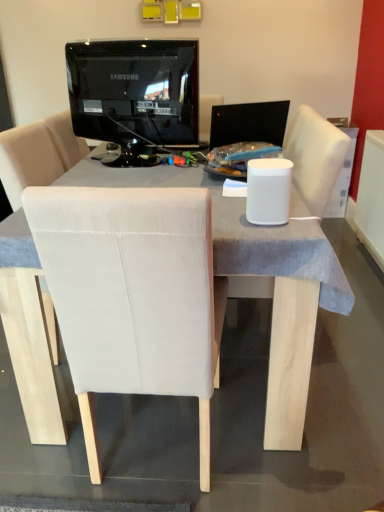
Question: In terms of width, does black glossy monitor at upper center look wider or thinner when compared to white plastic radiator at right?

Choices:
 (A) wide
 (B) thin

Answer: (A)

Question: Considering their positions, is black glossy monitor at upper center located in front of or behind white plastic radiator at right?

Choices:
 (A) front
 (B) behind

Answer: (A)

Question: Which object is positioned closest to the black glossy monitor at center?

Choices:
 (A) white plastic radiator at right
 (B) black glossy monitor at upper center

Answer: (B)

Question: Estimate the real-world distances between objects in this image. Which object is closer to the black glossy monitor at upper center?

Choices:
 (A) white plastic radiator at right
 (B) black glossy monitor at center

Answer: (B)